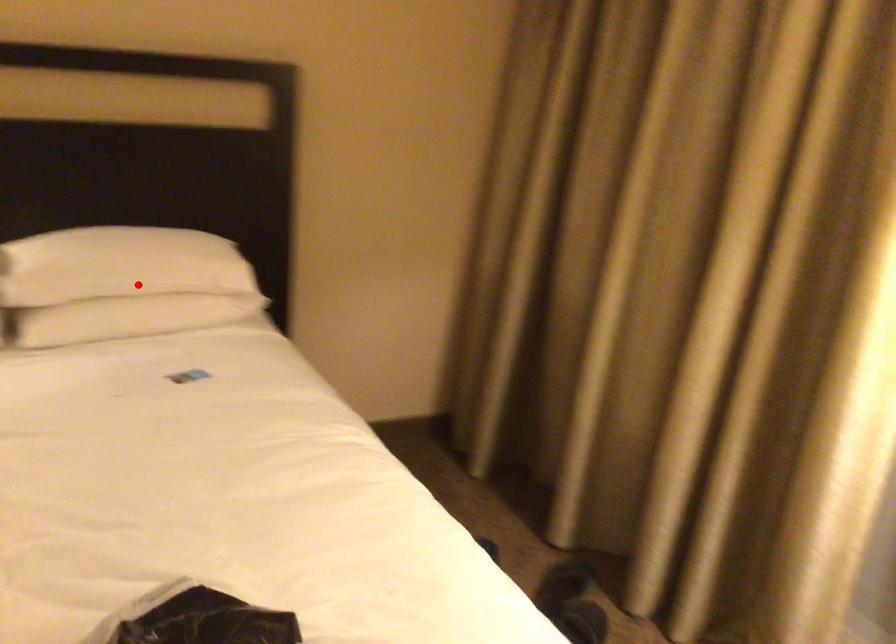
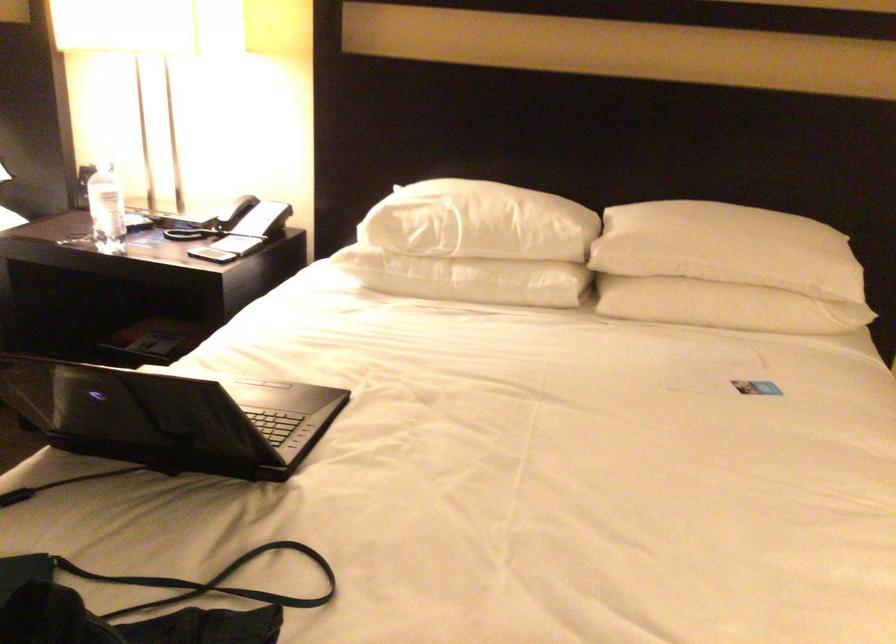
In the second image, find the point that corresponds to the highlighted location in the first image.

(727, 269)